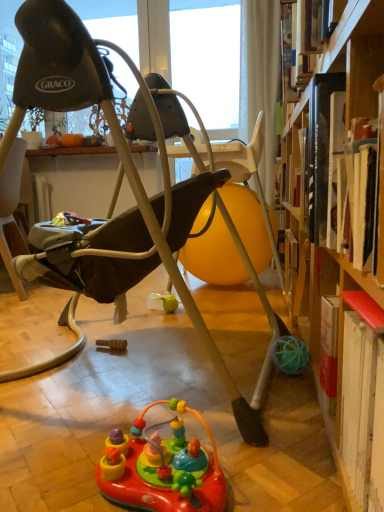
Question: Is multicolored plastic toy at center in front of or behind matte black swing at center in the image?

Choices:
 (A) behind
 (B) front

Answer: (B)

Question: In terms of width, does multicolored plastic toy at center look wider or thinner when compared to matte black swing at center?

Choices:
 (A) wide
 (B) thin

Answer: (B)

Question: Is point (114, 455) closer or farther from the camera than point (59, 90)?

Choices:
 (A) farther
 (B) closer

Answer: (B)

Question: Which is correct: matte black swing at center is inside multicolored plastic toy at center, or outside of it?

Choices:
 (A) outside
 (B) inside

Answer: (A)

Question: Is matte black swing at center wider or thinner than multicolored plastic toy at center?

Choices:
 (A) thin
 (B) wide

Answer: (B)

Question: In terms of height, does matte black swing at center look taller or shorter compared to multicolored plastic toy at center?

Choices:
 (A) tall
 (B) short

Answer: (A)

Question: From the image's perspective, is matte black swing at center located above or below multicolored plastic toy at center?

Choices:
 (A) above
 (B) below

Answer: (A)